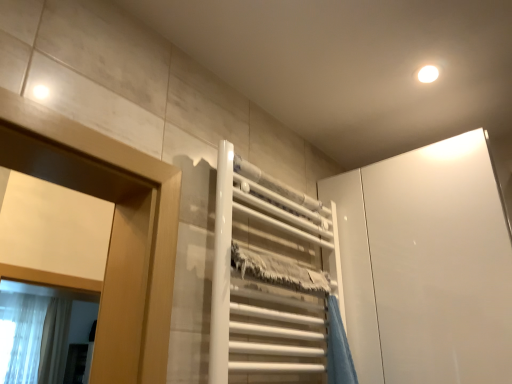
Question: Is translucent fabric shower curtain at lower left surrounded by white glossy towel rack at center?

Choices:
 (A) yes
 (B) no

Answer: (B)

Question: From the image's perspective, is white glossy towel rack at center located beneath translucent fabric shower curtain at lower left?

Choices:
 (A) yes
 (B) no

Answer: (B)

Question: Does white glossy towel rack at center have a greater height compared to translucent fabric shower curtain at lower left?

Choices:
 (A) no
 (B) yes

Answer: (A)

Question: From a real-world perspective, is white glossy towel rack at center physically below translucent fabric shower curtain at lower left?

Choices:
 (A) yes
 (B) no

Answer: (A)

Question: Is white glossy towel rack at center behind translucent fabric shower curtain at lower left?

Choices:
 (A) no
 (B) yes

Answer: (A)

Question: Looking at the image, does white glossy towel rack at center seem bigger or smaller compared to translucent fabric shower curtain at lower left?

Choices:
 (A) big
 (B) small

Answer: (B)

Question: From a real-world perspective, relative to translucent fabric shower curtain at lower left, is white glossy towel rack at center vertically above or below?

Choices:
 (A) above
 (B) below

Answer: (B)

Question: Is white glossy towel rack at center wider or thinner than translucent fabric shower curtain at lower left?

Choices:
 (A) thin
 (B) wide

Answer: (A)

Question: Relative to translucent fabric shower curtain at lower left, is white glossy towel rack at center in front or behind?

Choices:
 (A) behind
 (B) front

Answer: (B)

Question: Is point (7, 357) closer or farther from the camera than point (416, 231)?

Choices:
 (A) closer
 (B) farther

Answer: (B)

Question: Is translucent fabric shower curtain at lower left situated inside white glossy cabinet at upper right or outside?

Choices:
 (A) inside
 (B) outside

Answer: (B)

Question: Visually, is translucent fabric shower curtain at lower left positioned to the left or to the right of white glossy cabinet at upper right?

Choices:
 (A) left
 (B) right

Answer: (A)

Question: Is translucent fabric shower curtain at lower left taller or shorter than white glossy cabinet at upper right?

Choices:
 (A) tall
 (B) short

Answer: (A)

Question: In terms of width, does translucent fabric shower curtain at lower left look wider or thinner when compared to white glossy towel rack at center?

Choices:
 (A) wide
 (B) thin

Answer: (A)

Question: In terms of size, does translucent fabric shower curtain at lower left appear bigger or smaller than white glossy towel rack at center?

Choices:
 (A) big
 (B) small

Answer: (A)